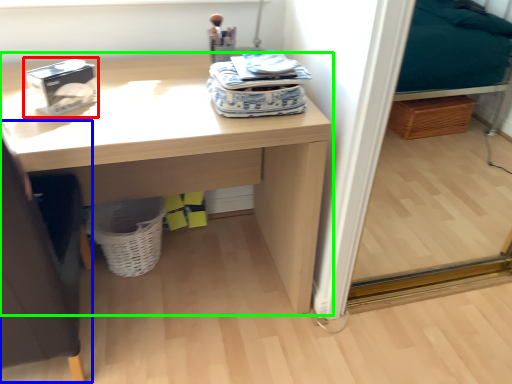
Question: Considering the real-world distances, which object is closest to box (highlighted by a red box)? swivel chair (highlighted by a blue box) or desk (highlighted by a green box).

Choices:
 (A) swivel chair
 (B) desk

Answer: (B)